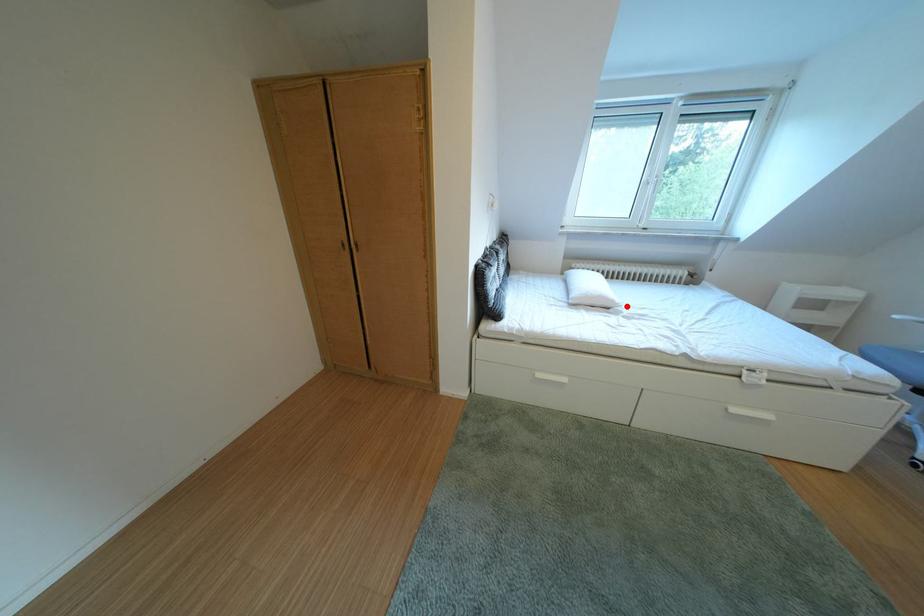
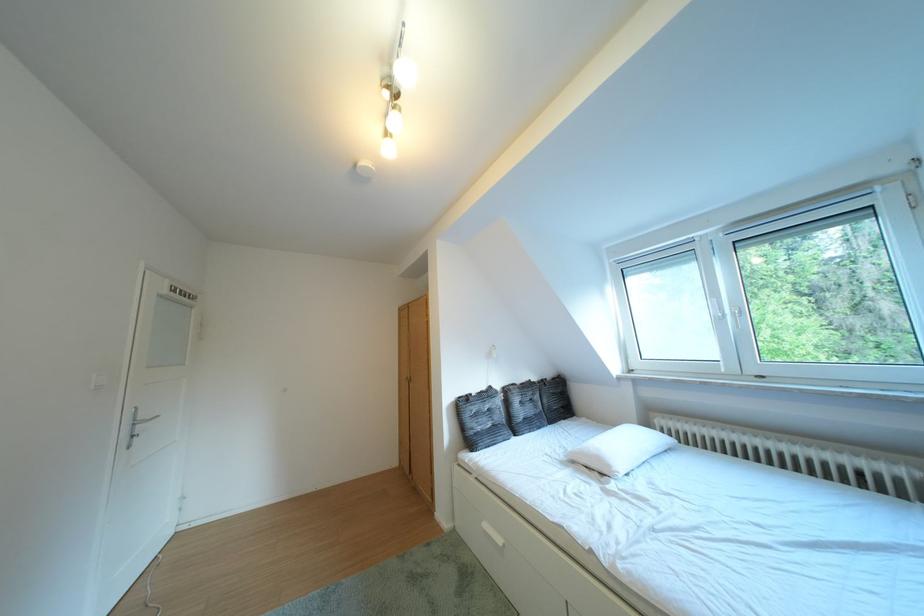
Question: I am providing you with two images of the same scene from different viewpoints. In image1, a red point is highlighted. Considering the same 3D point in image2, which of the following is correct?

Choices:
 (A) It is closer
 (B) It is farther

Answer: (B)